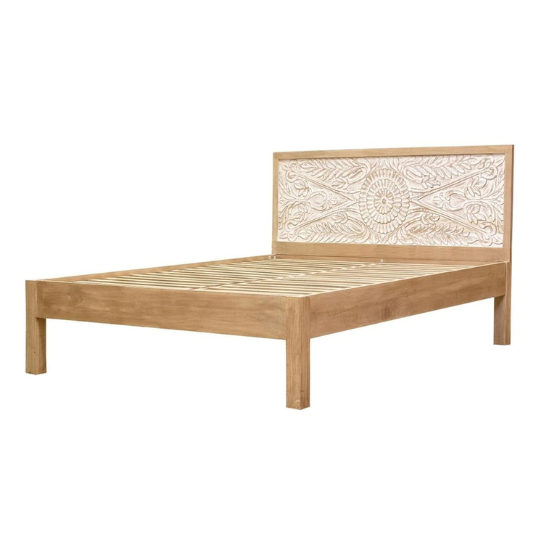
This screenshot has width=544, height=544. I want to click on bed frame, so click(392, 203).